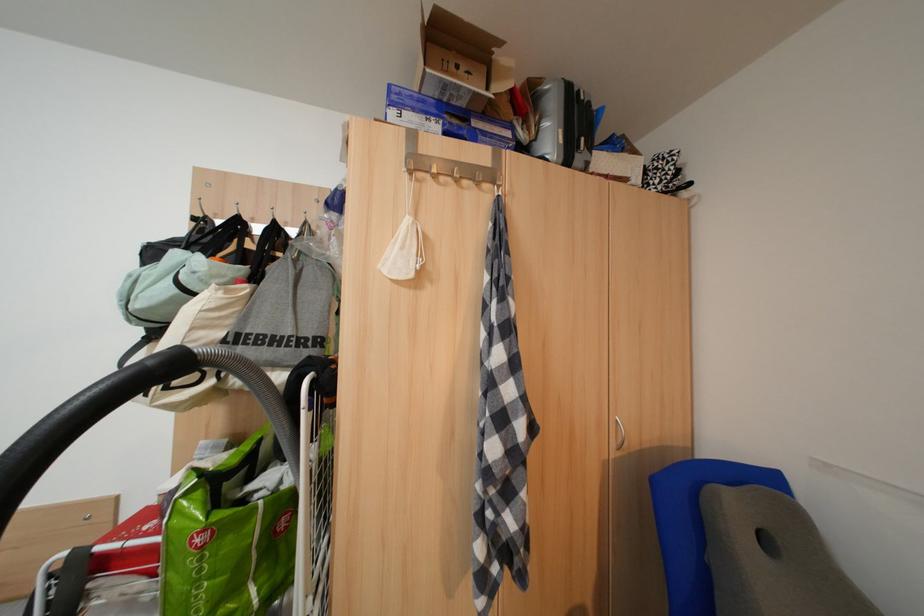
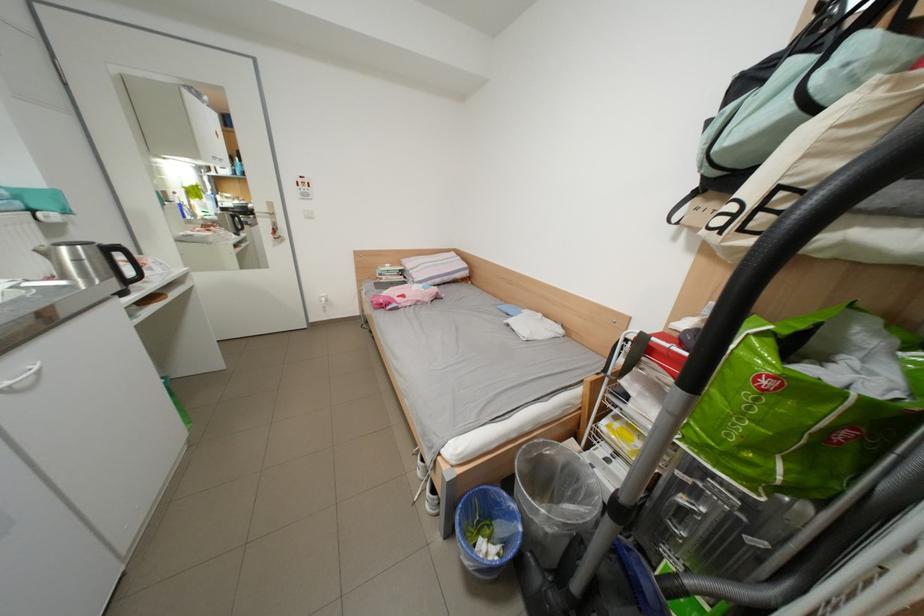
Find the pixel in the second image that matches (188,292) in the first image.

(801, 111)